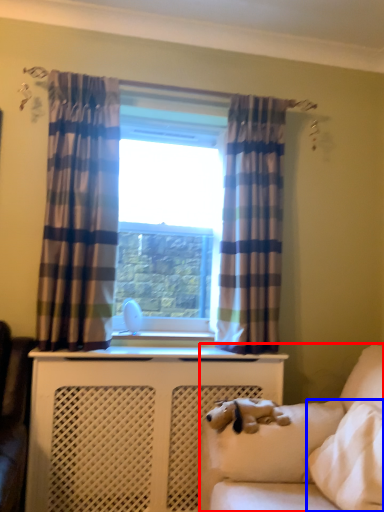
Question: Which of the following is the closest to the observer, studio couch (highlighted by a red box) or pillow (highlighted by a blue box)?

Choices:
 (A) studio couch
 (B) pillow

Answer: (B)